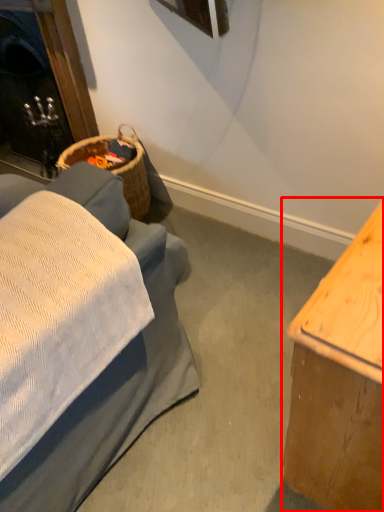
Question: From the image's perspective, where is table (annotated by the red box) located in relation to fireplace in the image?

Choices:
 (A) above
 (B) below

Answer: (B)